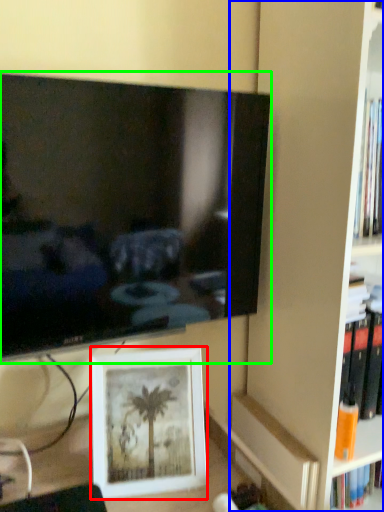
Question: Which object is positioned farthest from picture frame (highlighted by a red box)? Select from bookshelf (highlighted by a blue box) and television (highlighted by a green box).

Choices:
 (A) bookshelf
 (B) television

Answer: (A)